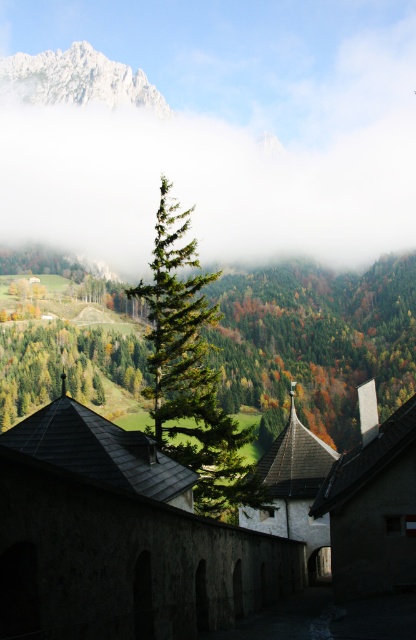
Does green matte tree at center have a lesser width compared to white rocky mountain at upper left?

No, green matte tree at center is not thinner than white rocky mountain at upper left.

Between point (349, 282) and point (116, 106), which one is positioned in front?

Positioned in front is point (349, 282).

Which is behind, point (49, 392) or point (52, 64)?

The point (52, 64) is more distant.

Identify the location of green matte tree at center. The image size is (416, 640). (316, 342).

Is point (49, 156) farther from camera compared to point (124, 84)?

No, it is in front of (124, 84).

Does white fluffy cloud at upper center appear under white rocky mountain at upper left?

Yes.

Is point (111, 77) closer to camera compared to point (71, 90)?

No, (111, 77) is further to viewer.

You are a GUI agent. You are given a task and a screenshot of the screen. Output one action in this format:
    pyautogui.click(x=<x>, y=<y>)
    Task: Click on the white fluffy cloud at upper center
    
    Given the screenshot: What is the action you would take?
    tap(190, 172)

Can you confirm if white fluffy cloud at upper center is thinner than green needle-like tree at center?

No.

Between white fluffy cloud at upper center and green needle-like tree at center, which one appears on the left side from the viewer's perspective?

Positioned to the left is green needle-like tree at center.

Between point (31, 147) and point (173, 433), which one is positioned in front?

Positioned in front is point (173, 433).

Find the location of a particular element. This screenshot has height=640, width=416. white fluffy cloud at upper center is located at coordinates (190, 172).